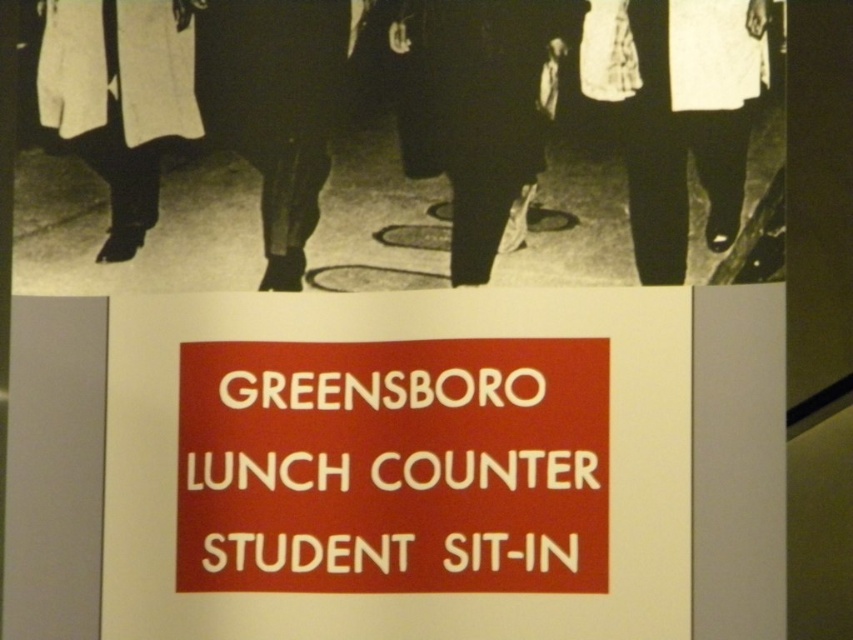
Based on the photo, between dark fabric pants at center and matte white coat at left, which one is positioned higher?

matte white coat at left is higher up.

The width and height of the screenshot is (853, 640). What do you see at coordinates (474, 113) in the screenshot? I see `dark fabric pants at center` at bounding box center [474, 113].

Between point (456, 88) and point (44, 104), which one is positioned in front?

Point (44, 104) is in front.

You are a GUI agent. You are given a task and a screenshot of the screen. Output one action in this format:
    pyautogui.click(x=<x>, y=<y>)
    Task: Click on the dark fabric pants at center
    
    Given the screenshot: What is the action you would take?
    pyautogui.click(x=474, y=113)

What do you see at coordinates (399, 467) in the screenshot? I see `matte red sign at center` at bounding box center [399, 467].

Measure the distance between matte red sign at center and camera.

They are 1.23 meters apart.

The width and height of the screenshot is (853, 640). In order to click on matte red sign at center in this screenshot , I will do `click(399, 467)`.

Between dark fabric pants at center and matte black pants at center, which one has more height?

Standing taller between the two is matte black pants at center.

Who is positioned more to the right, dark fabric pants at center or matte black pants at center?

Positioned to the right is dark fabric pants at center.

Between point (454, 184) and point (196, 52), which one is positioned in front?

Point (196, 52) is in front.

The width and height of the screenshot is (853, 640). Identify the location of dark fabric pants at center. (474, 113).